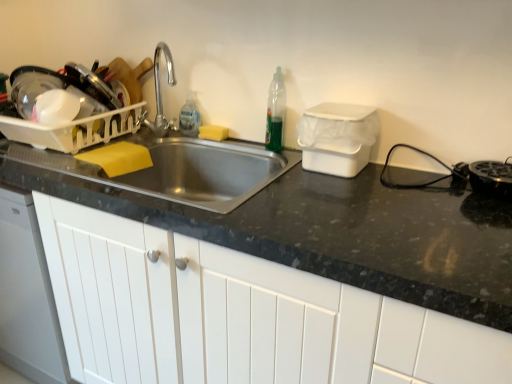
What do you see at coordinates (190, 116) in the screenshot? This screenshot has width=512, height=384. I see `translucent plastic bottle at sink, which is counted as the first bottle, starting from the back` at bounding box center [190, 116].

In order to face black plastic toaster at right, the 1th appliance from the right, should I rotate leftwards or rightwards?

Turn right approximately 29.929 degrees to face it.

How much space does white plastic dish rack at left, which ranks as the first appliance in left-to-right order, occupy horizontally?

white plastic dish rack at left, which ranks as the first appliance in left-to-right order, is 18.76 inches wide.

Where is `yellow sponge at sink`? The width and height of the screenshot is (512, 384). yellow sponge at sink is located at coordinates (213, 132).

Find the location of a particular element. The image size is (512, 384). white plastic container at upper right, arranged as the 2th appliance when viewed from the right is located at coordinates click(x=337, y=138).

Can you confirm if white plastic container at upper right, arranged as the second appliance when viewed from the left, is taller than yellow sponge at sink?

Yes.

Between point (304, 139) and point (216, 126), which one is positioned behind?

Point (216, 126)

Does white plastic container at upper right, arranged as the 2th appliance when viewed from the right, lie in front of yellow sponge at sink?

Yes, white plastic container at upper right, arranged as the 2th appliance when viewed from the right, is closer to the viewer.

Are white plastic container at upper right, arranged as the second appliance when viewed from the left, and yellow sponge at sink located far from each other?

No, white plastic container at upper right, arranged as the second appliance when viewed from the left, is not far away from yellow sponge at sink.

I want to click on appliance that is on the left side of green translucent bottle at upper right, marked as the 2th bottle in a left-to-right arrangement, so click(x=68, y=109).

Is white plastic dish rack at left, placed as the 3th appliance when sorted from right to left, aimed at green translucent bottle at upper right, marked as the 2th bottle in a left-to-right arrangement?

No, white plastic dish rack at left, placed as the 3th appliance when sorted from right to left, is not oriented towards green translucent bottle at upper right, marked as the 2th bottle in a left-to-right arrangement.

Considering the relative positions of white plastic dish rack at left, which ranks as the first appliance in left-to-right order, and green translucent bottle at upper right, the first bottle viewed from the front, in the image provided, is white plastic dish rack at left, which ranks as the first appliance in left-to-right order, to the right of green translucent bottle at upper right, the first bottle viewed from the front, from the viewer's perspective?

No, white plastic dish rack at left, which ranks as the first appliance in left-to-right order, is not to the right of green translucent bottle at upper right, the first bottle viewed from the front.

Looking at this image, relative to yellow sponge at sink, is white plastic dish rack at left, placed as the 3th appliance when sorted from right to left, in front or behind?

white plastic dish rack at left, placed as the 3th appliance when sorted from right to left, is in front of yellow sponge at sink.

Which is more to the left, white plastic dish rack at left, placed as the 3th appliance when sorted from right to left, or yellow sponge at sink?

white plastic dish rack at left, placed as the 3th appliance when sorted from right to left.

From the image's perspective, count 2nd bottles upward from the white plastic dish rack at left, which ranks as the first appliance in left-to-right order, and point to it. Please provide its 2D coordinates.

[(190, 116)]

Considering the positions of objects white plastic dish rack at left, placed as the 3th appliance when sorted from right to left, and translucent plastic bottle at sink, which is counted as the first bottle, starting from the back, in the image provided, who is in front, white plastic dish rack at left, placed as the 3th appliance when sorted from right to left, or translucent plastic bottle at sink, which is counted as the first bottle, starting from the back,?

white plastic dish rack at left, placed as the 3th appliance when sorted from right to left, is more forward.

In the scene shown: Which of these two, white plastic dish rack at left, which ranks as the first appliance in left-to-right order, or translucent plastic bottle at sink, which ranks as the second bottle in front-to-back order, is bigger?

Bigger between the two is white plastic dish rack at left, which ranks as the first appliance in left-to-right order.

How much distance is there between white plastic dish rack at left, which ranks as the first appliance in left-to-right order, and translucent plastic bottle at sink, marked as the 2th bottle in a right-to-left arrangement?

A distance of 15.12 inches exists between white plastic dish rack at left, which ranks as the first appliance in left-to-right order, and translucent plastic bottle at sink, marked as the 2th bottle in a right-to-left arrangement.

Can you confirm if white matte cabinet at center is smaller than white plastic dish rack at left, placed as the 3th appliance when sorted from right to left?

Actually, white matte cabinet at center might be larger than white plastic dish rack at left, placed as the 3th appliance when sorted from right to left.

Could you measure the distance between white matte cabinet at center and white plastic dish rack at left, placed as the 3th appliance when sorted from right to left?

55.85 centimeters.

Is white matte cabinet at center looking in the opposite direction of white plastic dish rack at left, placed as the 3th appliance when sorted from right to left?

No, white plastic dish rack at left, placed as the 3th appliance when sorted from right to left, is not at the back of white matte cabinet at center.

Are white matte cabinet at center and white plastic dish rack at left, placed as the 3th appliance when sorted from right to left, far apart?

No.

Locate an element on the screen. The height and width of the screenshot is (384, 512). appliance that is the 1st one below the green translucent bottle at upper right, the 2th bottle positioned from the back (from a real-world perspective) is located at coordinates (337, 138).

Is white plastic container at upper right, arranged as the second appliance when viewed from the left, with green translucent bottle at upper right, the 2th bottle positioned from the back?

There is a gap between white plastic container at upper right, arranged as the second appliance when viewed from the left, and green translucent bottle at upper right, the 2th bottle positioned from the back.

Is white plastic container at upper right, arranged as the 2th appliance when viewed from the right, inside the boundaries of green translucent bottle at upper right, the 2th bottle positioned from the back, or outside?

white plastic container at upper right, arranged as the 2th appliance when viewed from the right, is not inside green translucent bottle at upper right, the 2th bottle positioned from the back, it's outside.

Considering the positions of points (336, 158) and (282, 87), is point (336, 158) farther from camera compared to point (282, 87)?

No, (336, 158) is in front of (282, 87).

Based on the photo, is black plastic toaster at right, the 3th appliance positioned from the left, oriented towards white plastic dish rack at left, which ranks as the first appliance in left-to-right order?

No, black plastic toaster at right, the 3th appliance positioned from the left, is not aimed at white plastic dish rack at left, which ranks as the first appliance in left-to-right order.

Between black plastic toaster at right, the 1th appliance from the right, and white plastic dish rack at left, placed as the 3th appliance when sorted from right to left, which one has larger width?

white plastic dish rack at left, placed as the 3th appliance when sorted from right to left, is wider.

I want to click on the 2nd appliance to the right of the white plastic dish rack at left, which ranks as the first appliance in left-to-right order, counting from the anchor's position, so click(x=490, y=178).

In the image, there is a white plastic container at upper right, arranged as the 2th appliance when viewed from the right. Where is `food below it (from a real-world perspective)`? food below it (from a real-world perspective) is located at coordinates (213, 132).

Identify the location of the 1st appliance below when counting from the green translucent bottle at upper right, the 2th bottle positioned from the back (from the image's perspective). The image size is (512, 384). (68, 109).

From the picture: Based on their spatial positions, is yellow sponge at sink or white matte cabinet at center further from white plastic container at upper right, arranged as the second appliance when viewed from the left?

white matte cabinet at center.

Based on their spatial positions, is white matte cabinet at center or green translucent bottle at upper right, the first bottle viewed from the front, further from translucent plastic bottle at sink, which ranks as the second bottle in front-to-back order?

white matte cabinet at center lies further to translucent plastic bottle at sink, which ranks as the second bottle in front-to-back order, than the other object.

From the image, which object appears to be farther from white plastic container at upper right, arranged as the 2th appliance when viewed from the right, black plastic toaster at right, the 1th appliance from the right, or translucent plastic bottle at sink, which ranks as the second bottle in front-to-back order?

Based on the image, translucent plastic bottle at sink, which ranks as the second bottle in front-to-back order, appears to be further to white plastic container at upper right, arranged as the 2th appliance when viewed from the right.

When comparing their distances from white plastic dish rack at left, which ranks as the first appliance in left-to-right order, does translucent plastic bottle at sink, the first bottle from the left, or white matte cabinet at center seem further?

The object further to white plastic dish rack at left, which ranks as the first appliance in left-to-right order, is white matte cabinet at center.

Looking at the image, which one is located closer to green translucent bottle at upper right, the 2th bottle positioned from the back, black plastic toaster at right, the 1th appliance from the right, or white plastic container at upper right, arranged as the second appliance when viewed from the left?

white plastic container at upper right, arranged as the second appliance when viewed from the left, is positioned closer to the anchor green translucent bottle at upper right, the 2th bottle positioned from the back.

Looking at the image, which one is located closer to green translucent bottle at upper right, marked as the 2th bottle in a left-to-right arrangement, translucent plastic bottle at sink, marked as the 2th bottle in a right-to-left arrangement, or white matte cabinet at center?

The object closer to green translucent bottle at upper right, marked as the 2th bottle in a left-to-right arrangement, is translucent plastic bottle at sink, marked as the 2th bottle in a right-to-left arrangement.

Looking at the image, which one is located further to white plastic container at upper right, arranged as the 2th appliance when viewed from the right, translucent plastic bottle at sink, marked as the 2th bottle in a right-to-left arrangement, or white plastic dish rack at left, placed as the 3th appliance when sorted from right to left?

white plastic dish rack at left, placed as the 3th appliance when sorted from right to left, is further to white plastic container at upper right, arranged as the 2th appliance when viewed from the right.

When comparing their distances from translucent plastic bottle at sink, which ranks as the second bottle in front-to-back order, does green translucent bottle at upper right, which is the 1th bottle in right-to-left order, or white matte cabinet at center seem further?

white matte cabinet at center.

The image size is (512, 384). I want to click on appliance between white plastic dish rack at left, placed as the 3th appliance when sorted from right to left, and black plastic toaster at right, the 1th appliance from the right, from left to right, so 337,138.

Image resolution: width=512 pixels, height=384 pixels. What are the coordinates of `appliance between translucent plastic bottle at sink, which ranks as the second bottle in front-to-back order, and black plastic toaster at right, the 1th appliance from the right, from left to right` in the screenshot? It's located at (337, 138).

What are the coordinates of `food situated between white plastic dish rack at left, which ranks as the first appliance in left-to-right order, and white plastic container at upper right, arranged as the second appliance when viewed from the left, from left to right` in the screenshot? It's located at (213, 132).

What are the coordinates of `bottle located between white plastic container at upper right, arranged as the second appliance when viewed from the left, and yellow sponge at sink in the depth direction` in the screenshot? It's located at (275, 113).